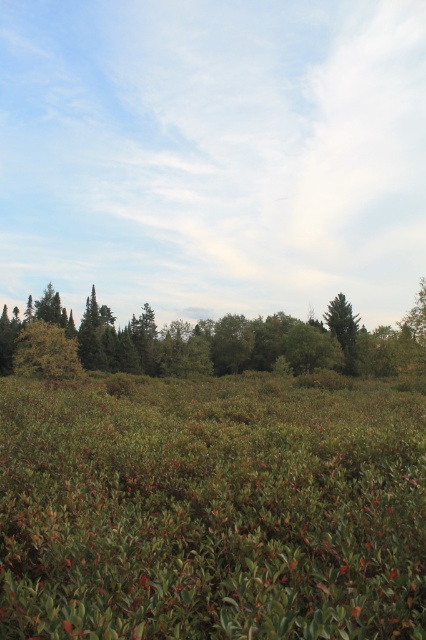
Is green matte grass at center behind green matte tree at center?

No, it is not.

Who is positioned more to the left, green matte grass at center or green matte tree at center?

green matte grass at center is more to the left.

The height and width of the screenshot is (640, 426). Find the location of `green matte grass at center`. green matte grass at center is located at coordinates (210, 508).